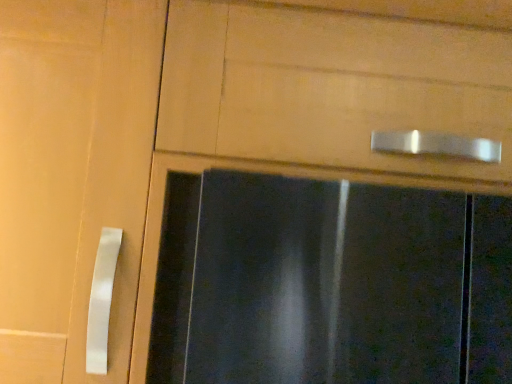
Describe the element at coordinates (322, 278) in the screenshot. This screenshot has width=512, height=384. I see `matte black glass door at center` at that location.

The image size is (512, 384). In order to click on matte black glass door at center in this screenshot , I will do `click(322, 278)`.

The width and height of the screenshot is (512, 384). In order to click on matte black glass door at center in this screenshot , I will do `click(322, 278)`.